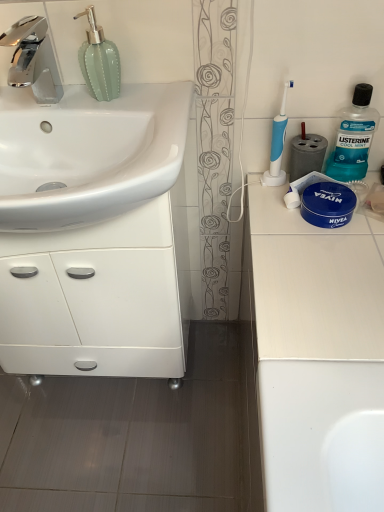
The width and height of the screenshot is (384, 512). Find the location of `vacant space that's between green glass soap dispenser at upper left and chrome metallic faucet at upper left`. vacant space that's between green glass soap dispenser at upper left and chrome metallic faucet at upper left is located at coordinates (79, 105).